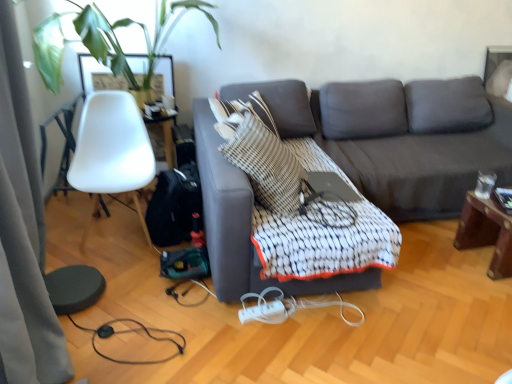
This screenshot has height=384, width=512. I want to click on vacant space in between dark gray fabric couch at center and white plastic cable at lower center, which is counted as the second cable, starting from the left, so click(416, 314).